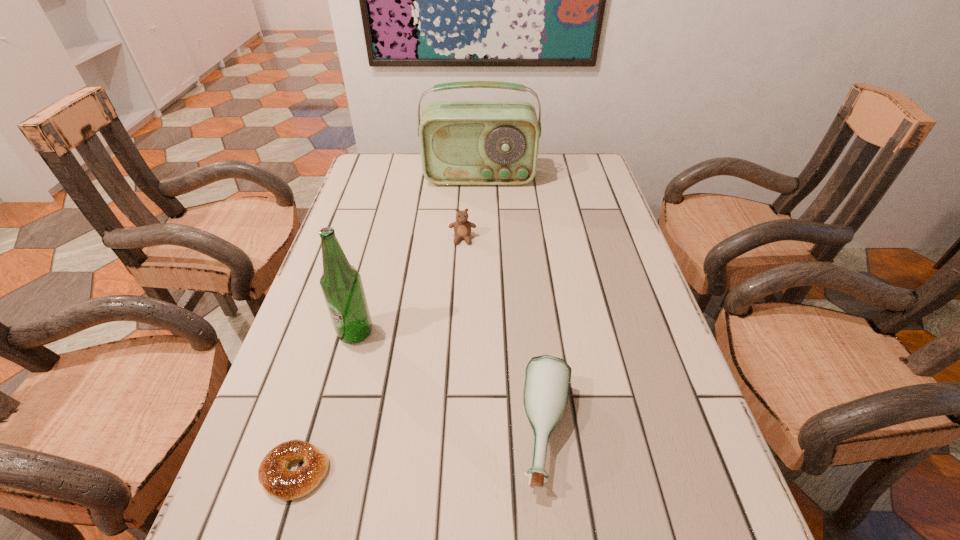
I want to click on object positioned at the far edge, so click(x=462, y=142).

Identify the location of beer bottle at the left edge. This screenshot has height=540, width=960. [341, 284].

The height and width of the screenshot is (540, 960). I want to click on bagel present at the left edge, so click(x=273, y=474).

Locate an element on the screen. This screenshot has width=960, height=540. vacant space at the far edge is located at coordinates (487, 187).

At what (x,y) coordinates should I click in order to perform the action: click on vacant space at the left edge of the desktop. Please return your answer as a coordinate pair (x, y). This screenshot has height=540, width=960. Looking at the image, I should click on (283, 428).

I want to click on vacant space at the right edge of the desktop, so click(x=675, y=428).

Identify the location of vacant space at the far left corner of the desktop. (376, 152).

In the image, there is a desktop. Where is `free space at the far right corner`? This screenshot has height=540, width=960. free space at the far right corner is located at coordinates (564, 186).

In order to click on free space between the third farthest object and the bagel in this screenshot , I will do `click(325, 402)`.

At what (x,y) coordinates should I click in order to perform the action: click on empty space between the radio receiver and the beer bottle. Please return your answer as a coordinate pair (x, y). The width and height of the screenshot is (960, 540). Looking at the image, I should click on (418, 255).